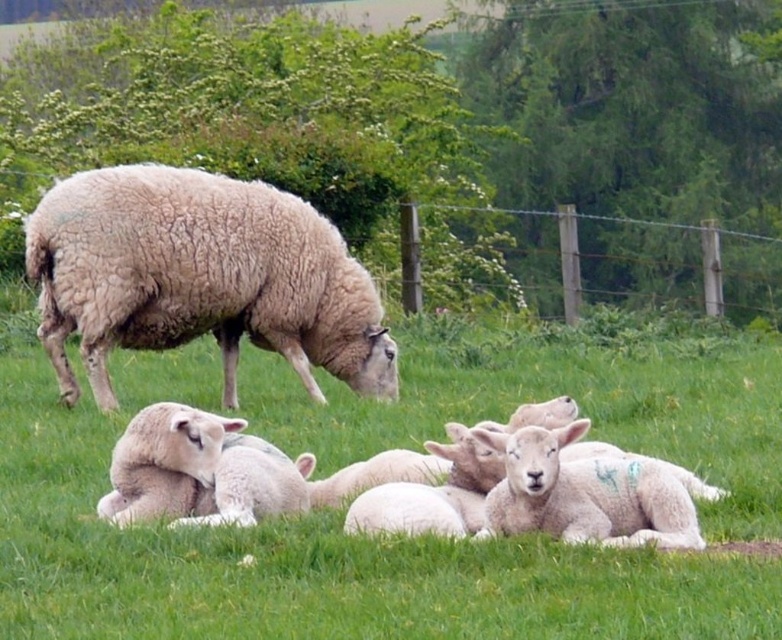
Question: Can you confirm if white woolen sheep at center is bigger than white woolen lamb at lower right?

Choices:
 (A) yes
 (B) no

Answer: (B)

Question: Observing the image, what is the correct spatial positioning of white woolen sheep at center in reference to white woolen lamb at lower right?

Choices:
 (A) right
 (B) left

Answer: (B)

Question: Which is farther from the white woolen sheep at lower center?

Choices:
 (A) white woolly sheep at center
 (B) wooden post at upper center

Answer: (B)

Question: Which of the following is the closest to the observer?

Choices:
 (A) white woolen sheep at center
 (B) white woolen sheep at lower center

Answer: (A)

Question: Considering the relative positions of white woolen sheep at center and wooden post at upper center in the image provided, where is white woolen sheep at center located with respect to wooden post at upper center?

Choices:
 (A) left
 (B) right

Answer: (A)

Question: Which of these objects is positioned closest to the wooden post at upper center?

Choices:
 (A) white woolen lamb at lower right
 (B) white woolen sheep at center

Answer: (A)